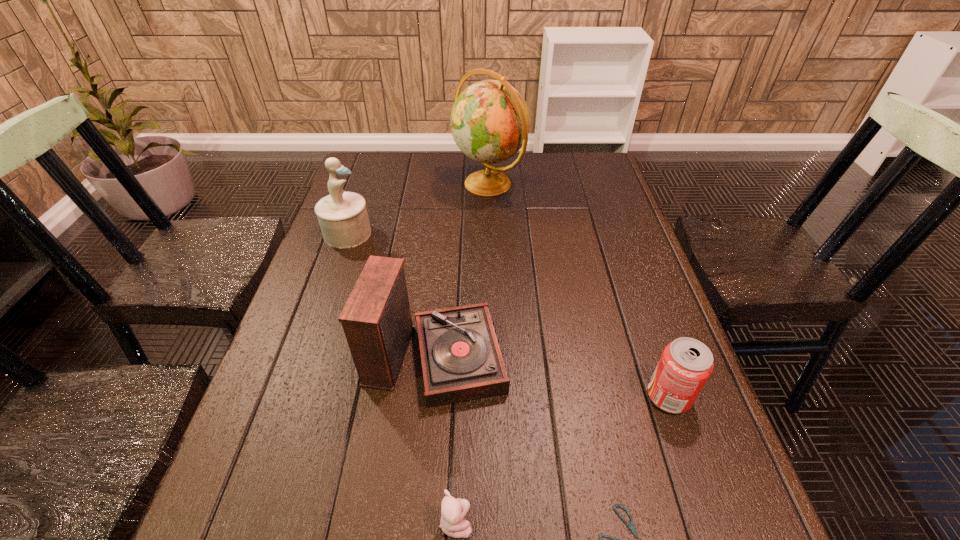
Where is `the tallest object`? Image resolution: width=960 pixels, height=540 pixels. the tallest object is located at coordinates (490, 121).

Identify the location of the farthest object. This screenshot has height=540, width=960. (490, 121).

I want to click on figurine, so click(343, 218).

Find the location of `the second farthest object`. the second farthest object is located at coordinates (343, 218).

Identify the location of phonograph record. (461, 360).

Identify the location of the rightmost object. (686, 364).

Locate an element on the screen. soda can is located at coordinates (686, 364).

Where is `vacant space positioned on the back of the globe`? This screenshot has width=960, height=540. vacant space positioned on the back of the globe is located at coordinates (489, 158).

Identify the location of vacant space located 0.280m at the beak of the figurine. (469, 233).

This screenshot has width=960, height=540. Identify the location of free point located on the back of the phonograph record. (444, 265).